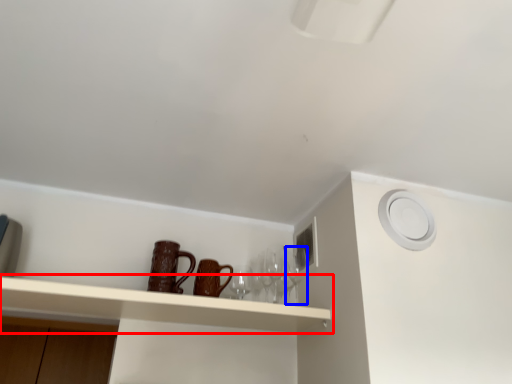
Question: Which point is closer to the camera, shelf (highlighted by a red box) or wine glass (highlighted by a blue box)?

Choices:
 (A) shelf
 (B) wine glass

Answer: (A)